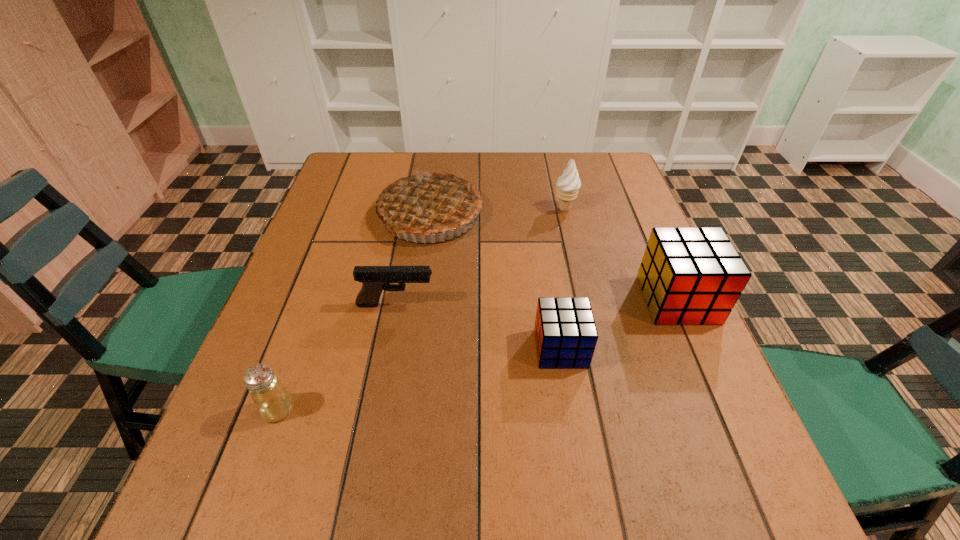
Where is `object located in the right edge section of the desktop`? The image size is (960, 540). object located in the right edge section of the desktop is located at coordinates (688, 275).

Where is `object that is at the near left corner`? object that is at the near left corner is located at coordinates (273, 402).

At what (x,y) coordinates should I click in order to perform the action: click on vacant space at the far edge. Please return your answer as a coordinate pair (x, y). Looking at the image, I should click on (507, 157).

Locate an element on the screen. The width and height of the screenshot is (960, 540). vacant space at the near edge of the desktop is located at coordinates (557, 416).

In the image, there is a desktop. Where is `vacant space at the left edge`? Image resolution: width=960 pixels, height=540 pixels. vacant space at the left edge is located at coordinates (346, 266).

You are a GUI agent. You are given a task and a screenshot of the screen. Output one action in this format:
    pyautogui.click(x=<x>, y=<y>)
    Task: Click on the free region at the right edge of the desktop
    The width and height of the screenshot is (960, 540).
    Given the screenshot: What is the action you would take?
    pyautogui.click(x=642, y=234)

The width and height of the screenshot is (960, 540). Find the location of `free space at the near left corner`. free space at the near left corner is located at coordinates (230, 425).

This screenshot has width=960, height=540. Identify the location of vacant area that lies between the leftmost object and the right cube. (478, 354).

You are a GUI agent. You are given a task and a screenshot of the screen. Output one action in this format:
    pyautogui.click(x=<x>, y=<y>)
    Task: Click on the vacant area between the pistol and the nearer cube
    
    Given the screenshot: What is the action you would take?
    pyautogui.click(x=478, y=327)

The height and width of the screenshot is (540, 960). I want to click on vacant region between the farther cube and the second nearest object, so (619, 324).